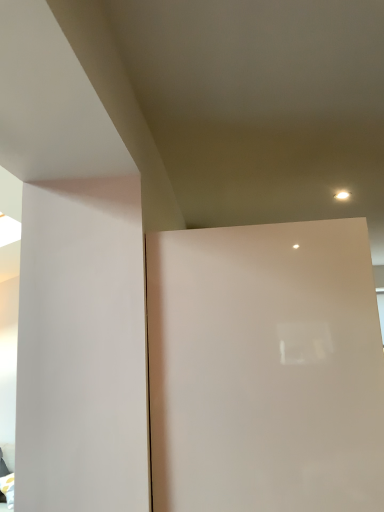
The height and width of the screenshot is (512, 384). What do you see at coordinates (265, 369) in the screenshot?
I see `white glossy door at center` at bounding box center [265, 369].

Measure the distance between white glossy door at center and camera.

white glossy door at center and camera are 3.32 feet apart from each other.

Identify the location of white glossy door at center. The width and height of the screenshot is (384, 512). (265, 369).

Find the location of a particular element. This screenshot has width=384, height=512. white glossy door at center is located at coordinates (265, 369).